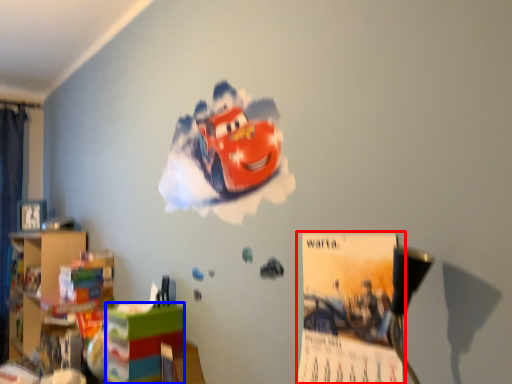
Question: Which object appears farthest to the camera in this image, poster page (highlighted by a red box) or shelf (highlighted by a blue box)?

Choices:
 (A) poster page
 (B) shelf

Answer: (B)